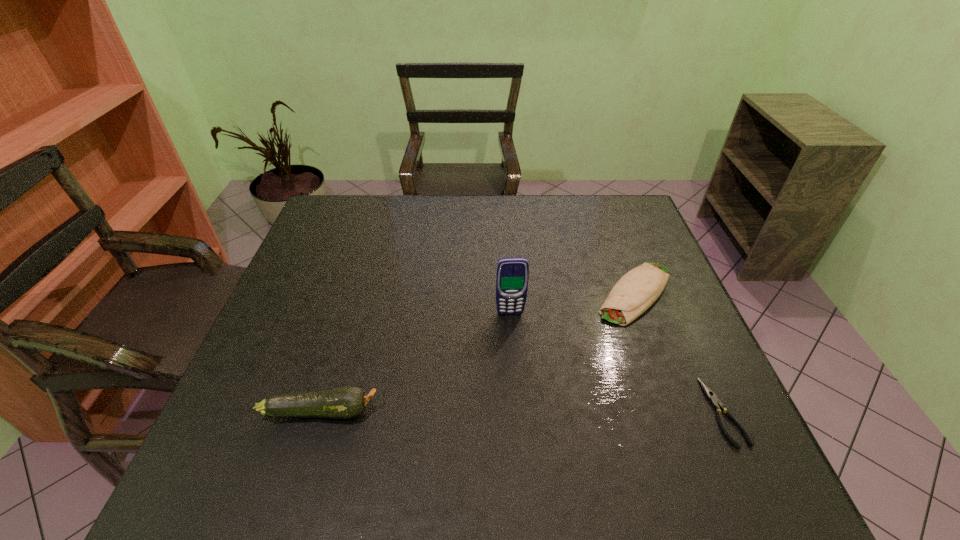
Where is `free spot on the desktop that is between the third shortest object and the shortest object and is positioned at the bitten end of the second shortest object`? This screenshot has width=960, height=540. free spot on the desktop that is between the third shortest object and the shortest object and is positioned at the bitten end of the second shortest object is located at coordinates (526, 411).

Where is `vacant space on the desktop that is between the third shortest object and the shortest object and is positioned on the front-facing side of the tallest object`? vacant space on the desktop that is between the third shortest object and the shortest object and is positioned on the front-facing side of the tallest object is located at coordinates (523, 411).